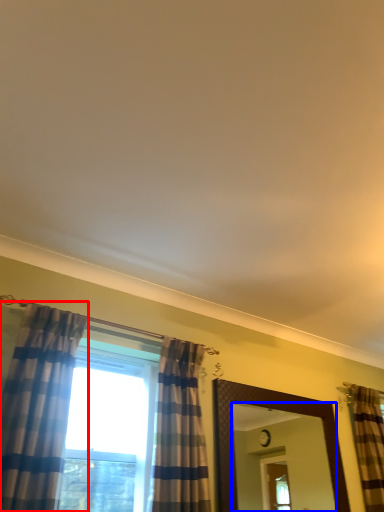
Question: Which of the following is the farthest to the observer, curtain (highlighted by a red box) or mirror (highlighted by a blue box)?

Choices:
 (A) curtain
 (B) mirror

Answer: (B)